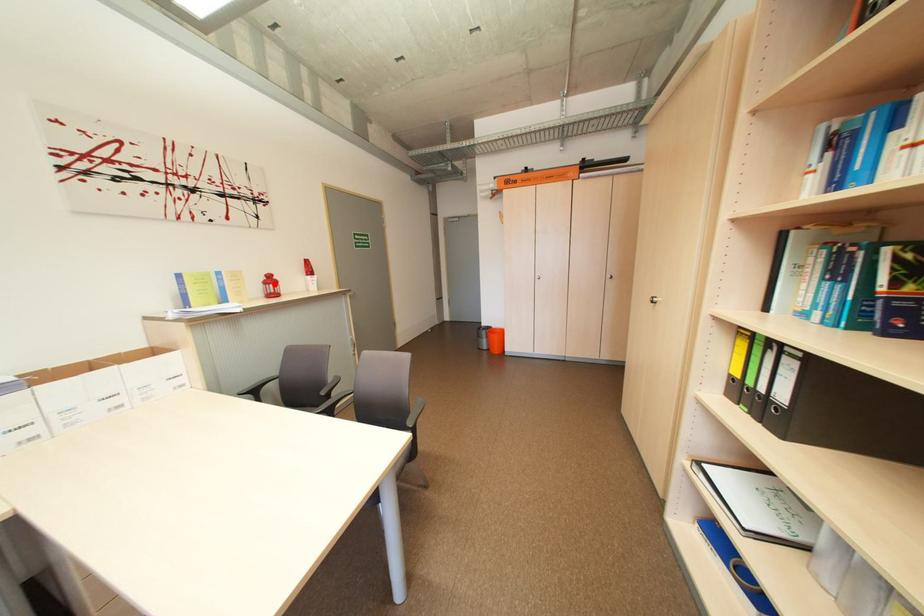
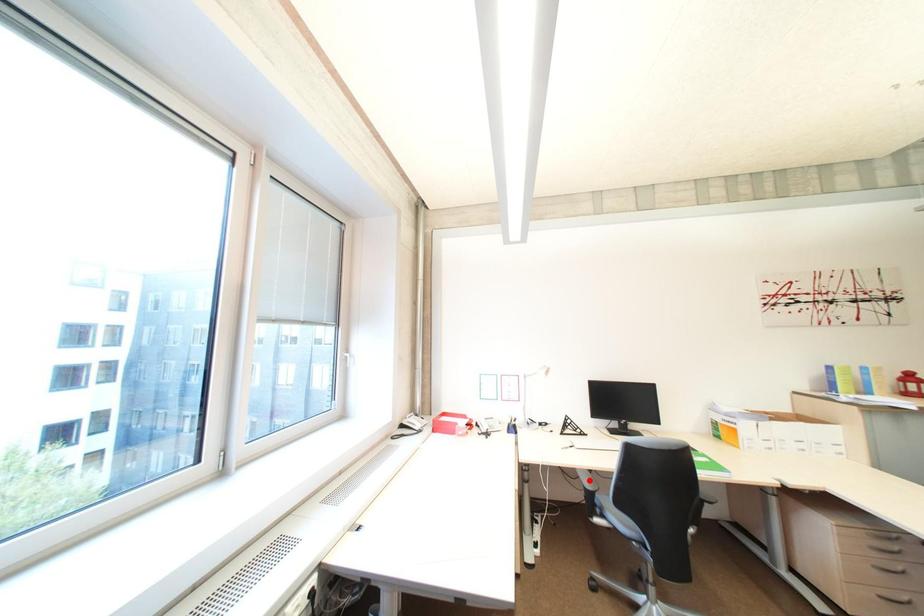
I am providing you with two images of the same scene from different viewpoints. A red point is marked on the first image and another point is marked on the second image. Does the point marked in image1 correspond to the same location as the one in image2?

No